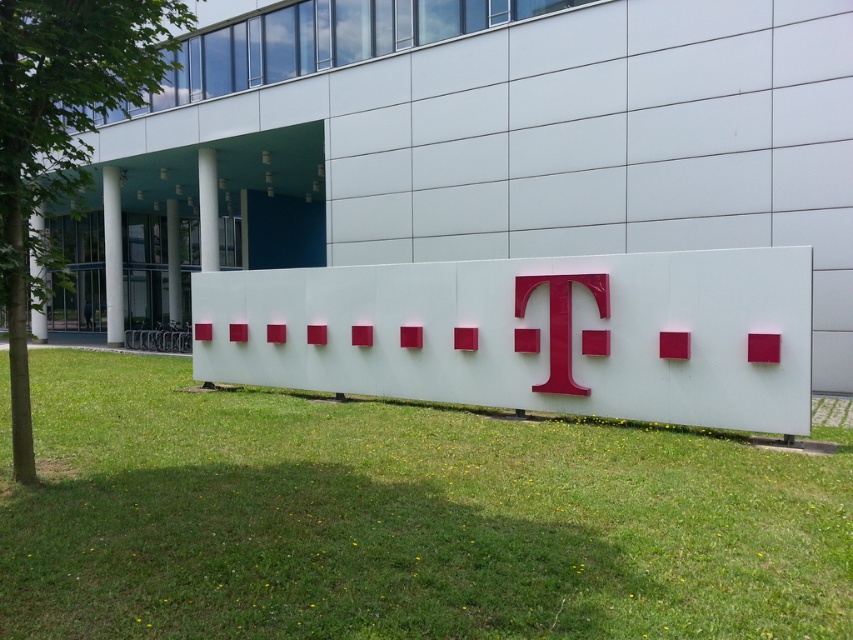
Question: Where is green grass at lower center located in relation to white glossy sign at center in the image?

Choices:
 (A) left
 (B) right

Answer: (A)

Question: Can you confirm if green grass at lower center is positioned above glossy plastic t at center?

Choices:
 (A) yes
 (B) no

Answer: (B)

Question: Which object is the closest to the white glossy sign at center?

Choices:
 (A) glossy plastic t at center
 (B) green grass at lower center

Answer: (A)

Question: Is green grass at lower center bigger than glossy plastic t at center?

Choices:
 (A) yes
 (B) no

Answer: (A)

Question: Which object appears farthest from the camera in this image?

Choices:
 (A) white glossy sign at center
 (B) glossy plastic t at center
 (C) green grass at lower center

Answer: (B)

Question: Which of the following is the closest to the observer?

Choices:
 (A) green grass at lower center
 (B) glossy plastic t at center
 (C) white glossy sign at center

Answer: (A)